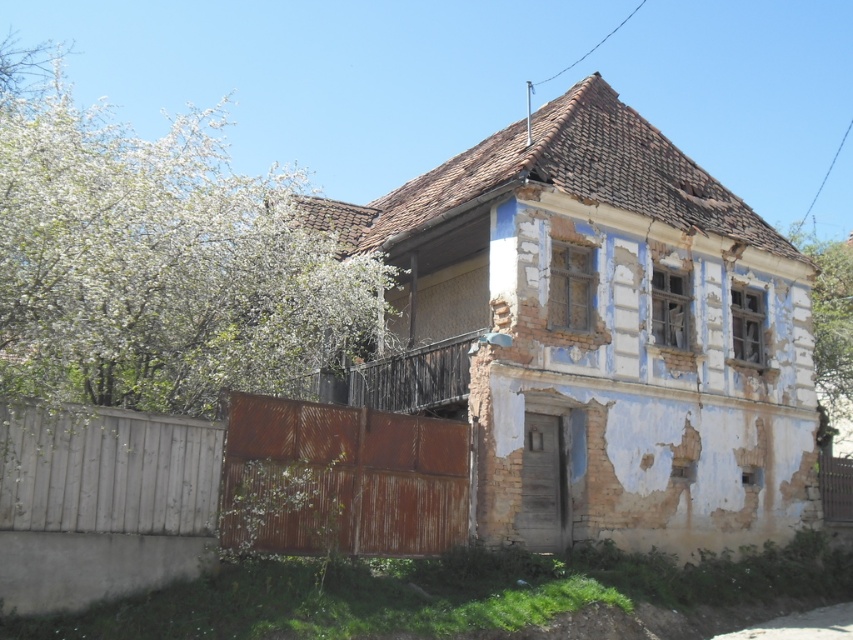
You are standing in front of the old house and want to enter through the gate. Which fence, the rusty corrugated metal fence at lower left or the white wooden fence at lower left, is closer to you as you approach the gate?

The rusty corrugated metal fence at lower left is closer to you because the white wooden fence at lower left is behind it.

You are a painter who needs to decide which object to paint first between the white textured wall at upper right and the rusty metal gate at lower right. If the wall is wider than the gate, you should start with the wall. Based on the scene, which object should you choose?

The white textured wall at upper right might be wider than rusty metal gate at lower right, so you should start with the white textured wall at upper right.

You are standing at the entrance of the old house and notice a point marked at coordinates (340, 480). What object does this point correspond to?

The point at coordinates (340, 480) corresponds to the rusty corrugated metal fence at lower left.